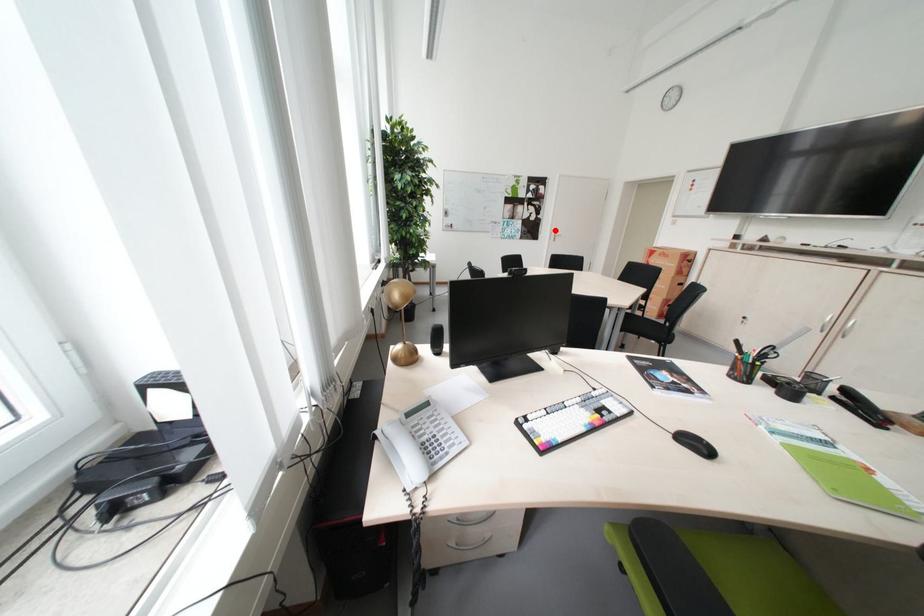
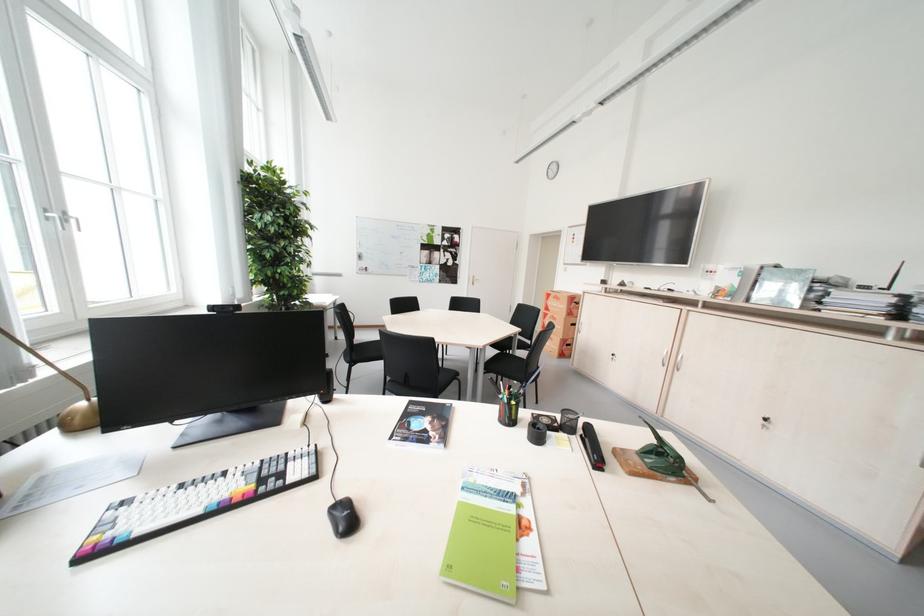
Locate, in the second image, the point that corresponds to the highlighted location in the first image.

(473, 275)